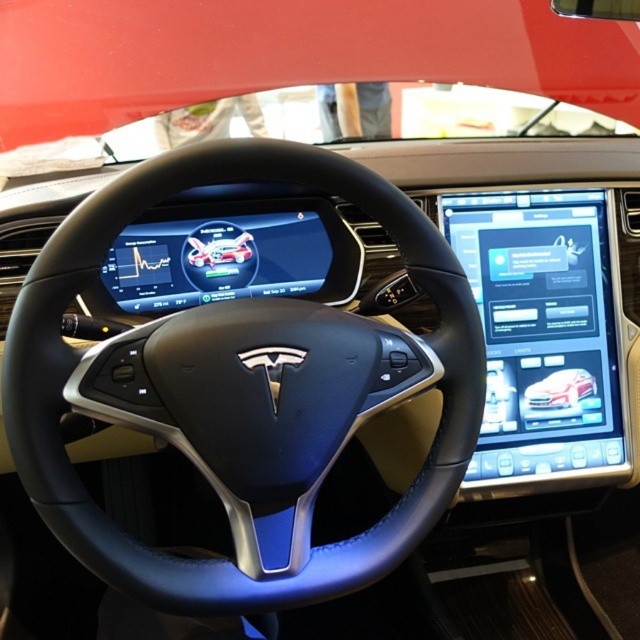
Does black leather steering wheel at center appear under white glossy car at center?

No, black leather steering wheel at center is not below white glossy car at center.

Is black leather steering wheel at center positioned at the back of white glossy car at center?

That is False.

Where is `black leather steering wheel at center`? This screenshot has height=640, width=640. black leather steering wheel at center is located at coordinates click(241, 392).